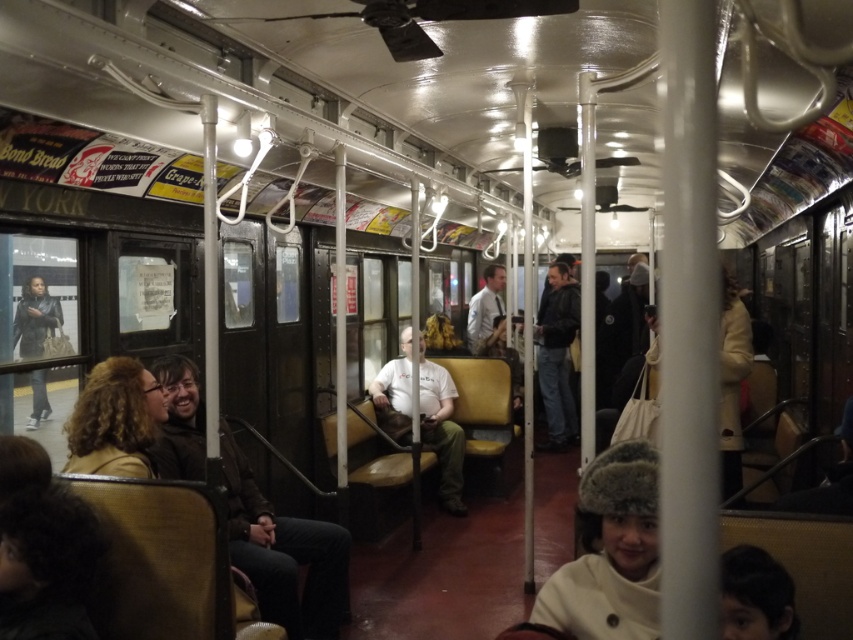
Question: Is the position of dark brown leather jacket at center less distant than that of light brown leather jacket at center?

Choices:
 (A) no
 (B) yes

Answer: (B)

Question: Which point is closer to the camera?

Choices:
 (A) (346, 584)
 (B) (546, 324)
 (C) (395, 380)

Answer: (A)

Question: Can you confirm if dark brown leather jacket at center is positioned below light brown leather jacket at center?

Choices:
 (A) no
 (B) yes

Answer: (B)

Question: Is dark brown leather jacket at center to the right of light brown leather jacket at center from the viewer's perspective?

Choices:
 (A) no
 (B) yes

Answer: (A)

Question: Based on their relative distances, which object is nearer to the dark brown leather jacket at center?

Choices:
 (A) light brown leather jacket at center
 (B) dark blue jeans at center

Answer: (A)

Question: Which of the following is the closest to the observer?

Choices:
 (A) dark blue jeans at center
 (B) dark brown leather jacket at center

Answer: (B)